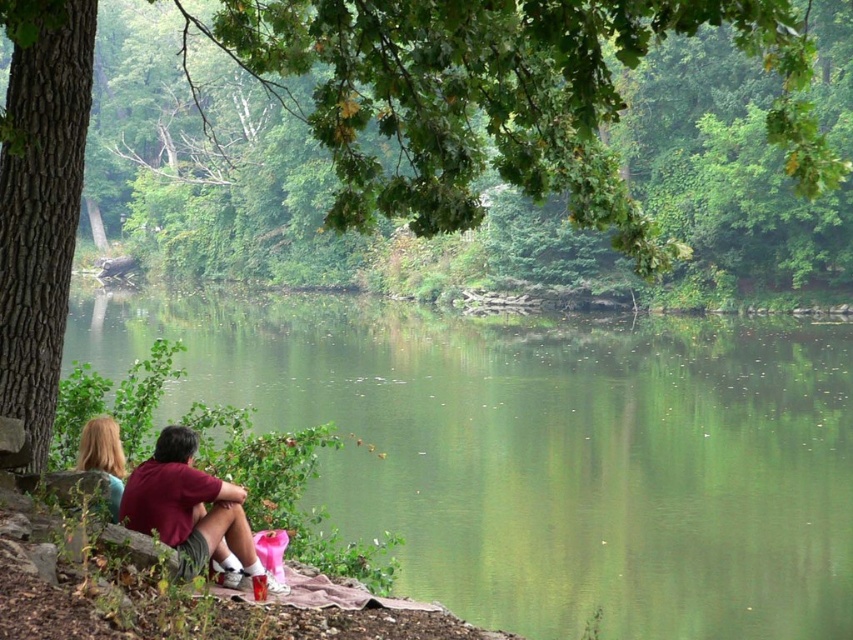
Question: Can you confirm if maroon cotton shirt at lower left is positioned above blonde hair at left?

Choices:
 (A) no
 (B) yes

Answer: (A)

Question: Can you confirm if maroon cotton shirt at lower left is positioned below blonde hair at left?

Choices:
 (A) no
 (B) yes

Answer: (B)

Question: Which of the following is the farthest from the observer?

Choices:
 (A) (106, 465)
 (B) (158, 474)
 (C) (349, 416)

Answer: (C)

Question: Estimate the real-world distances between objects in this image. Which object is closer to the maroon cotton shirt at lower left?

Choices:
 (A) blonde hair at left
 (B) smooth brown tree trunk at left

Answer: (A)

Question: Estimate the real-world distances between objects in this image. Which object is farther from the smooth brown tree trunk at left?

Choices:
 (A) maroon cotton shirt at lower left
 (B) green smooth water at lower center
 (C) blonde hair at left

Answer: (B)

Question: Can you confirm if smooth brown tree trunk at left is positioned below maroon cotton shirt at lower left?

Choices:
 (A) yes
 (B) no

Answer: (B)